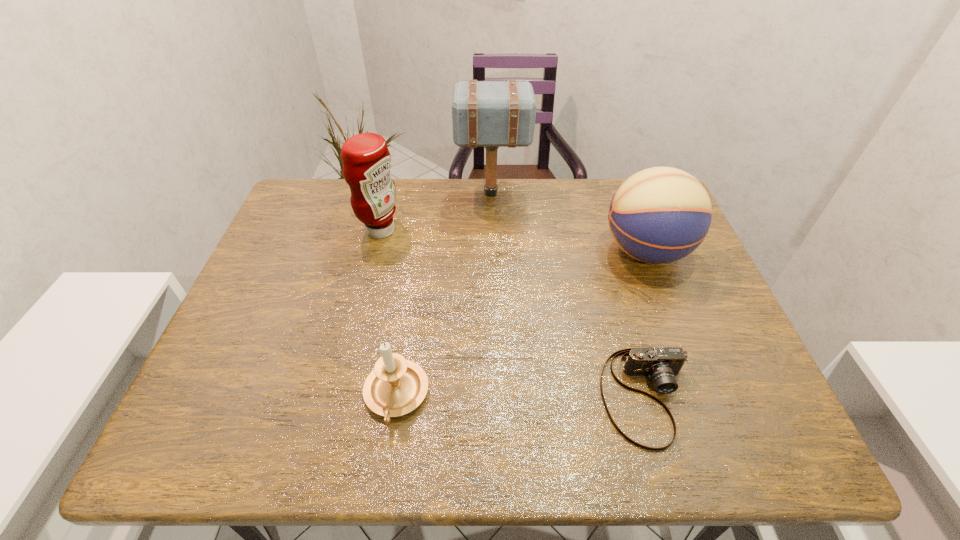
Find the location of a particular element. This screenshot has height=540, width=960. vacant point that satisfies the following two spatial constraints: 1. on the patterned surface of the basketball; 2. with a handle on the side of the second shortest object is located at coordinates (701, 396).

You are a GUI agent. You are given a task and a screenshot of the screen. Output one action in this format:
    pyautogui.click(x=<x>, y=<y>)
    Task: Click on the vacant space that satisfies the following two spatial constraints: 1. on the striking surface of the mallet; 2. with a handle on the side of the candle holder
    This screenshot has width=960, height=540.
    Given the screenshot: What is the action you would take?
    pyautogui.click(x=497, y=396)

Find the location of a particular element. blank space that satisfies the following two spatial constraints: 1. on the patterned surface of the basketball; 2. with a handle on the side of the candle holder is located at coordinates (701, 396).